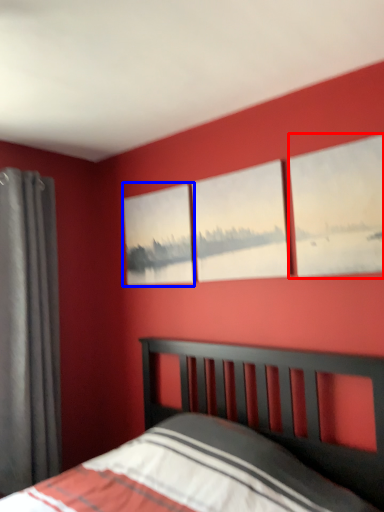
Question: Which object appears closest to the camera in this image, window (highlighted by a red box) or picture frame (highlighted by a blue box)?

Choices:
 (A) window
 (B) picture frame

Answer: (A)